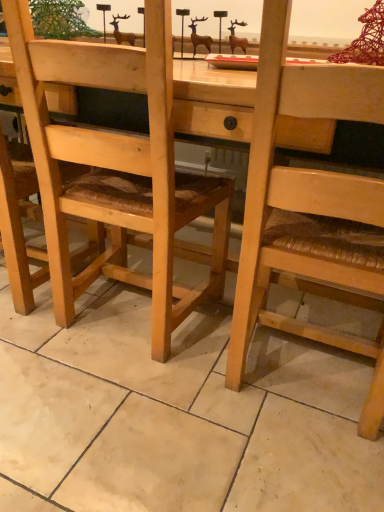
Locate an element on the screen. This screenshot has height=512, width=384. free space to the left of natural wood chair at center, which is the second chair from left to right is located at coordinates (159, 379).